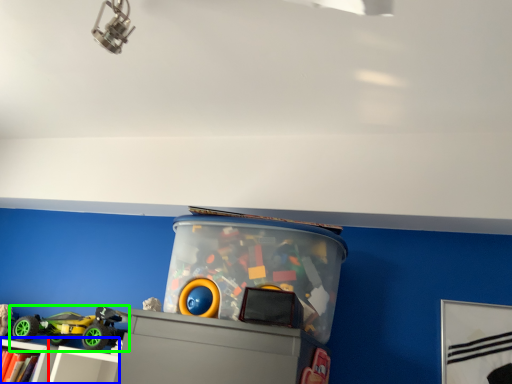
Question: Considering the real-world distances, which object is closest to bookcase (highlighted by a red box)? shelf (highlighted by a blue box) or toy (highlighted by a green box).

Choices:
 (A) shelf
 (B) toy

Answer: (A)